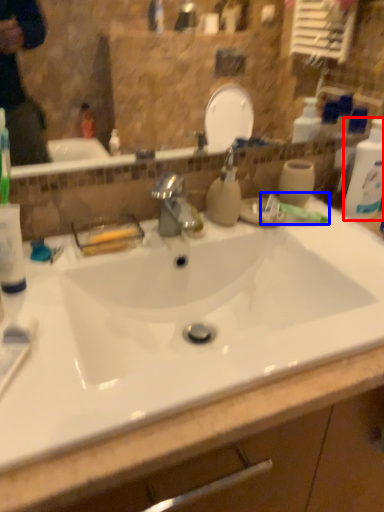
Question: Which object appears closest to the camera in this image, cleaning product (highlighted by a red box) or toothpaste (highlighted by a blue box)?

Choices:
 (A) cleaning product
 (B) toothpaste

Answer: (A)